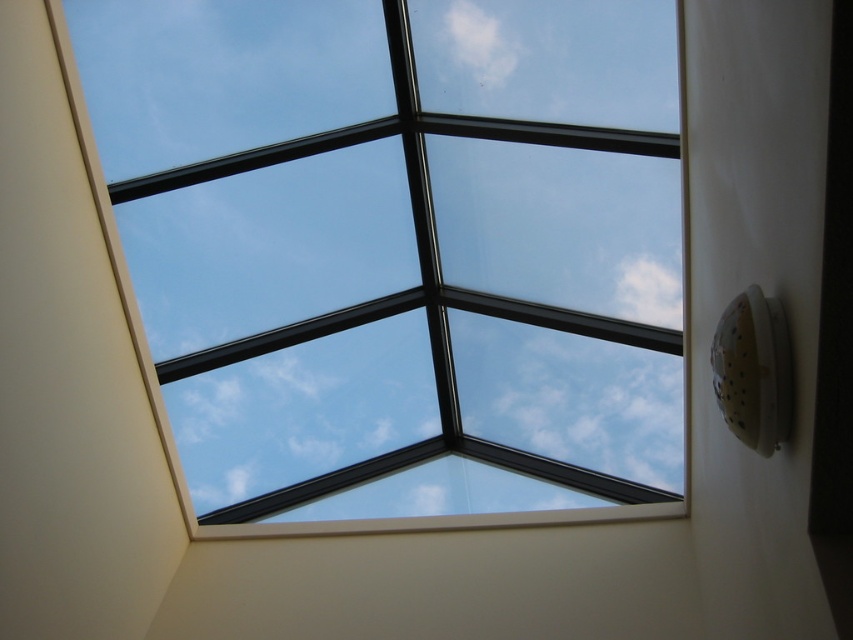
Question: Can you confirm if transparent glass skylight at upper center is bigger than white fluffy cloud at upper center?

Choices:
 (A) yes
 (B) no

Answer: (A)

Question: Which point appears farthest from the camera in this image?

Choices:
 (A) (418, 100)
 (B) (480, 10)

Answer: (A)

Question: Is transparent glass skylight at upper center smaller than white fluffy cloud at upper center?

Choices:
 (A) no
 (B) yes

Answer: (A)

Question: Can you confirm if transparent glass skylight at upper center is bigger than white fluffy cloud at upper center?

Choices:
 (A) yes
 (B) no

Answer: (A)

Question: Which object appears closest to the camera in this image?

Choices:
 (A) white fluffy cloud at upper center
 (B) transparent glass skylight at upper center

Answer: (B)